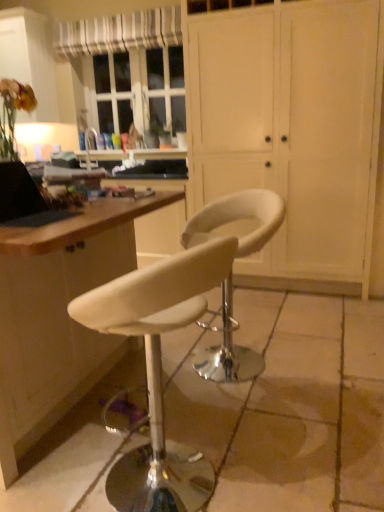
I want to click on free space to the left of white leather stool at center, which appears as the 2th chair when viewed from the back, so click(67, 461).